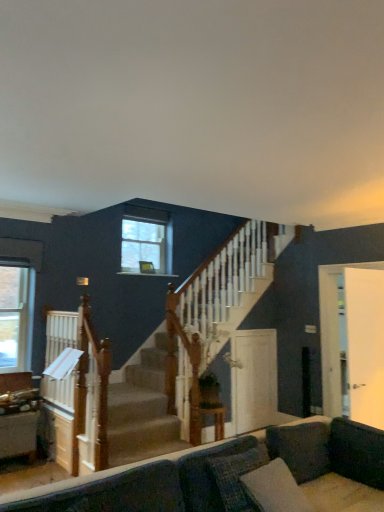
Question: Is clear glass window at upper center, positioned as the 1th window in top-to-bottom order, looking in the opposite direction of white glossy door at center, which is counted as the second screen door, starting from the right?

Choices:
 (A) no
 (B) yes

Answer: (A)

Question: From a real-world perspective, is clear glass window at upper center, marked as the 2th window in a bottom-to-top arrangement, beneath white glossy door at center, the 1th screen door positioned from the back?

Choices:
 (A) no
 (B) yes

Answer: (A)

Question: Is clear glass window at upper center, arranged as the 2th window when viewed from the left, taller than white glossy door at center, which is counted as the second screen door, starting from the right?

Choices:
 (A) no
 (B) yes

Answer: (A)

Question: Can you confirm if clear glass window at upper center, marked as the first window in a back-to-front arrangement, is wider than white glossy door at center, which is counted as the 1th screen door, starting from the left?

Choices:
 (A) no
 (B) yes

Answer: (A)

Question: Is the depth of clear glass window at upper center, the second window in the front-to-back sequence, less than that of white glossy door at center, the 1th screen door positioned from the back?

Choices:
 (A) no
 (B) yes

Answer: (A)

Question: Does clear glass window at upper center, marked as the first window in a back-to-front arrangement, have a lesser width compared to white glossy door at center, the 2th screen door viewed from the front?

Choices:
 (A) no
 (B) yes

Answer: (B)

Question: Can you confirm if clear glass window at upper center, the second window in the front-to-back sequence, is bigger than wooden table at center?

Choices:
 (A) yes
 (B) no

Answer: (B)

Question: Is clear glass window at upper center, marked as the 2th window in a bottom-to-top arrangement, wider than wooden table at center?

Choices:
 (A) no
 (B) yes

Answer: (A)

Question: Are clear glass window at upper center, marked as the 2th window in a bottom-to-top arrangement, and wooden table at center making contact?

Choices:
 (A) no
 (B) yes

Answer: (A)

Question: From the image's perspective, is clear glass window at upper center, positioned as the 1th window in top-to-bottom order, under wooden table at center?

Choices:
 (A) no
 (B) yes

Answer: (A)

Question: Can you confirm if clear glass window at upper center, marked as the 2th window in a bottom-to-top arrangement, is smaller than wooden table at center?

Choices:
 (A) no
 (B) yes

Answer: (B)

Question: Is clear glass window at upper center, marked as the first window in a back-to-front arrangement, further to camera compared to wooden table at center?

Choices:
 (A) yes
 (B) no

Answer: (A)

Question: Does white glossy door at center, the 2th screen door viewed from the front, have a smaller size compared to velvet dark gray couch at lower center?

Choices:
 (A) no
 (B) yes

Answer: (B)